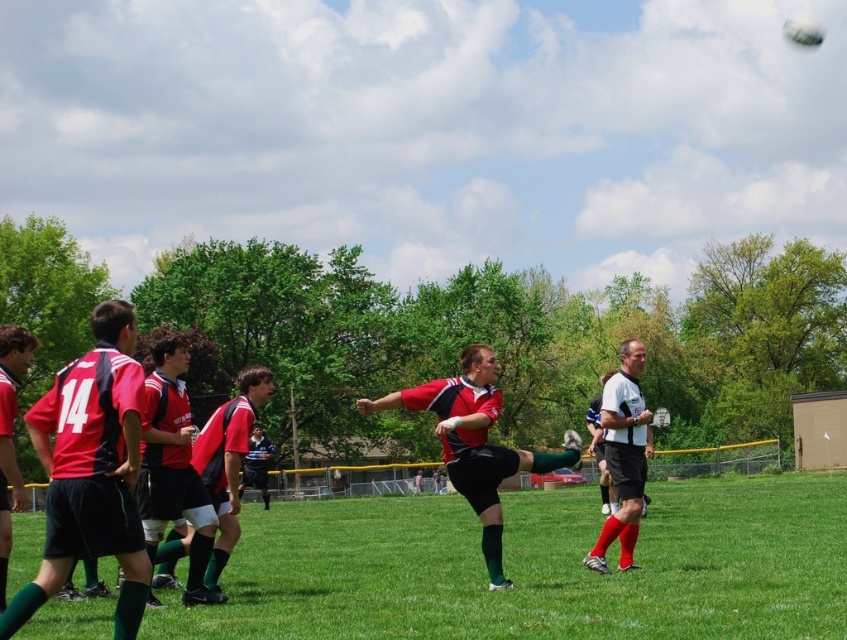
Can you confirm if matte red jersey at center is taller than white mesh shirt at right?

In fact, matte red jersey at center may be shorter than white mesh shirt at right.

Who is more distant from viewer, [217,508] or [617,397]?

Positioned behind is point [617,397].

Does point (213, 545) come in front of point (634, 449)?

Yes, it is.

Identify the location of matte red jersey at center. This screenshot has width=847, height=640. (220, 483).

Is matte red soccer ball at center in front of white mesh shirt at right?

Yes.

Does point (508, 472) lie behind point (612, 477)?

No, (508, 472) is closer to viewer.

Find the location of a particular element. The height and width of the screenshot is (640, 847). matte red soccer ball at center is located at coordinates (475, 442).

Does green grass at center have a larger size compared to matte red jersey at center?

Yes, green grass at center is bigger than matte red jersey at center.

Does green grass at center lie behind matte red jersey at center?

That is False.

This screenshot has height=640, width=847. What do you see at coordinates (537, 566) in the screenshot? I see `green grass at center` at bounding box center [537, 566].

This screenshot has width=847, height=640. Identify the location of green grass at center. (537, 566).